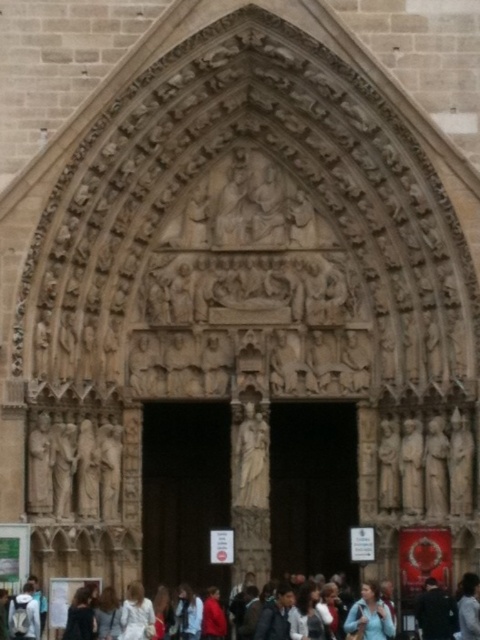
Question: Which of these objects is positioned farthest from the dark gray fabric jacket at lower center?

Choices:
 (A) multicolored fabric crowd at lower center
 (B) brown wooden door at center

Answer: (B)

Question: Which point is closer to the camera?

Choices:
 (A) dark wood door at center
 (B) white fabric at lower center
 (C) brown wooden door at center
 (D) dark gray fabric jacket at lower center

Answer: (B)

Question: Is dark wood door at center smaller than dark gray fabric jacket at lower center?

Choices:
 (A) yes
 (B) no

Answer: (B)

Question: Estimate the real-world distances between objects in this image. Which object is closer to the dark gray fabric jacket at lower center?

Choices:
 (A) light blue fabric at center
 (B) multicolored fabric crowd at lower center
 (C) dark wood door at center
 (D) white fabric at lower center

Answer: (D)

Question: Can you confirm if dark gray fabric jacket at lower center is wider than white fabric at lower center?

Choices:
 (A) no
 (B) yes

Answer: (B)

Question: Can you confirm if dark wood door at center is wider than dark gray fabric jacket at lower center?

Choices:
 (A) no
 (B) yes

Answer: (B)